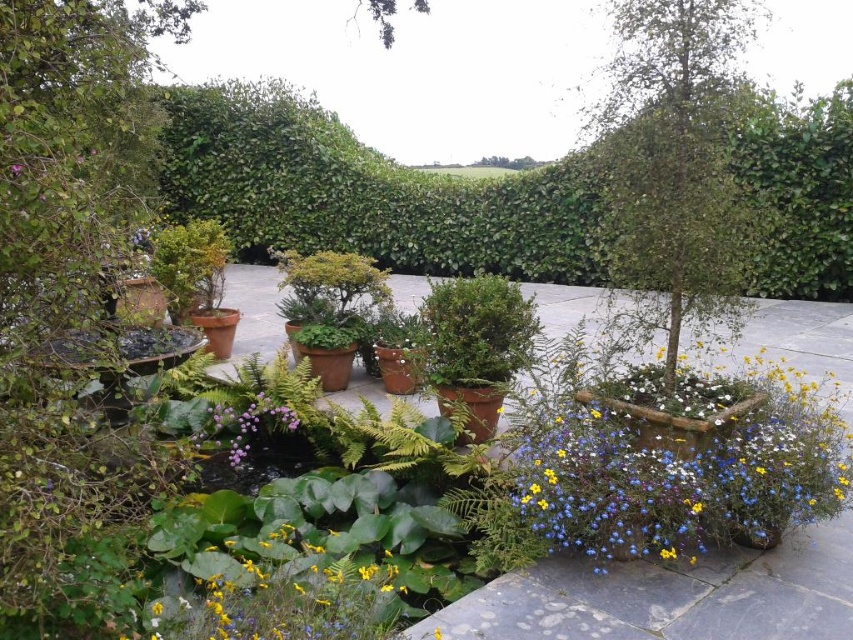
Question: Does vibrant multicolored flowers at center right come in front of yellow matte flower at center?

Choices:
 (A) yes
 (B) no

Answer: (B)

Question: Does green leafy tree at center have a larger size compared to purple matte flower at center?

Choices:
 (A) no
 (B) yes

Answer: (B)

Question: Which of the following is the closest to the observer?

Choices:
 (A) yellow matte flower at center
 (B) green leafy hedge at upper center
 (C) purple matte flower at center

Answer: (A)

Question: Does green leafy tree at left have a larger size compared to yellow matte flower at center?

Choices:
 (A) no
 (B) yes

Answer: (B)

Question: Which point is closer to the camera taking this photo?

Choices:
 (A) [x=798, y=524]
 (B) [x=218, y=620]
 (C) [x=270, y=413]

Answer: (B)

Question: Which object is positioned closest to the green leafy tree at left?

Choices:
 (A) yellow matte flower at center
 (B) green leafy tree at center
 (C) purple matte flower at center

Answer: (C)